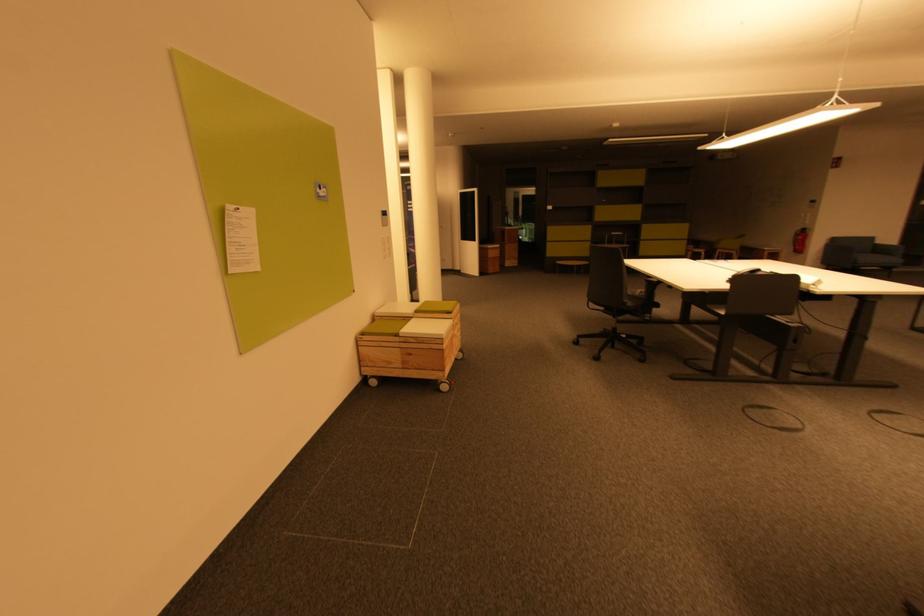
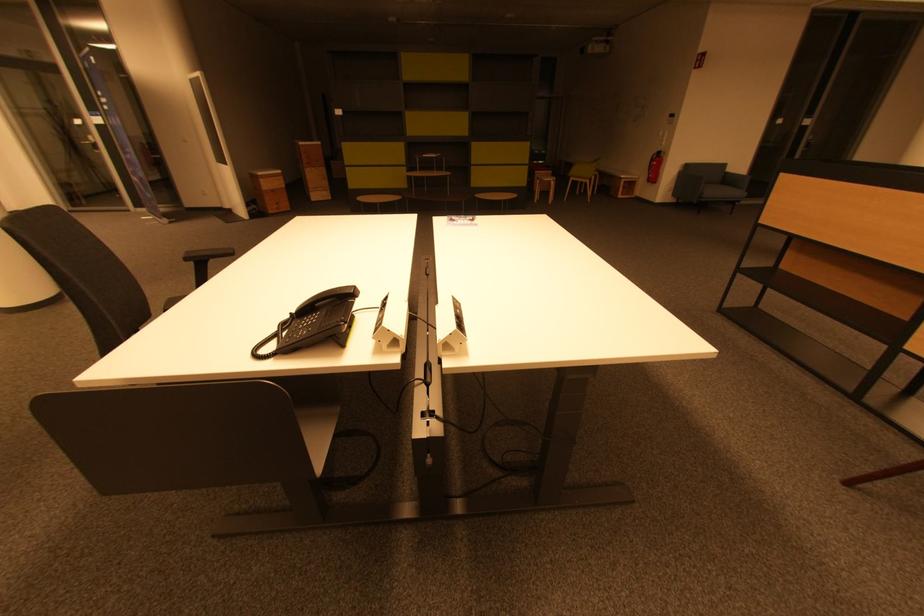
The images are taken continuously from a first-person perspective. In which direction are you moving?

The cameraman walked toward right, forward.